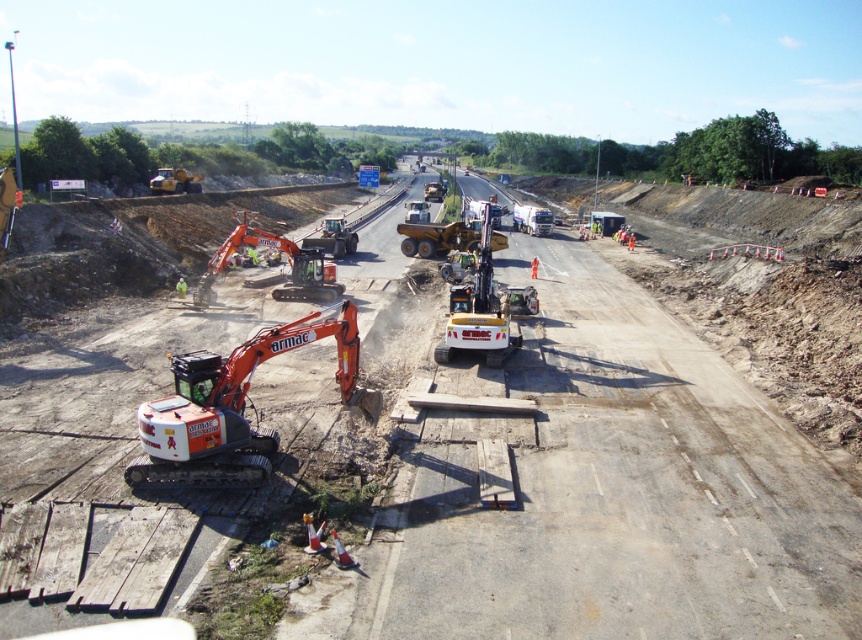
From the picture: Between yellow rubber truck at upper left and white plastic truck at center, which one appears on the right side from the viewer's perspective?

From the viewer's perspective, white plastic truck at center appears more on the right side.

Does yellow rubber truck at upper left have a greater width compared to white plastic truck at center?

Correct, the width of yellow rubber truck at upper left exceeds that of white plastic truck at center.

In order to click on yellow rubber truck at upper left in this screenshot , I will do `click(175, 180)`.

Does point (444, 236) come in front of point (195, 186)?

Yes, point (444, 236) is closer to viewer.

Where is `yellow metallic dump truck at center`? This screenshot has width=862, height=640. yellow metallic dump truck at center is located at coordinates (447, 237).

In order to click on yellow metallic dump truck at center in this screenshot , I will do `click(447, 237)`.

Which is below, orange rubber tracked excavator at left or white plastic truck at center?

orange rubber tracked excavator at left is below.

Can you confirm if orange rubber tracked excavator at left is shorter than white plastic truck at center?

No, orange rubber tracked excavator at left is not shorter than white plastic truck at center.

Which is behind, point (310, 284) or point (547, 228)?

Point (547, 228)

What are the coordinates of `orange rubber tracked excavator at left` in the screenshot? It's located at (283, 273).